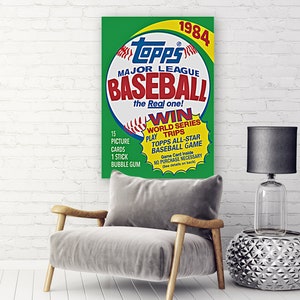
The height and width of the screenshot is (300, 300). I want to click on lampshade, so click(275, 154).